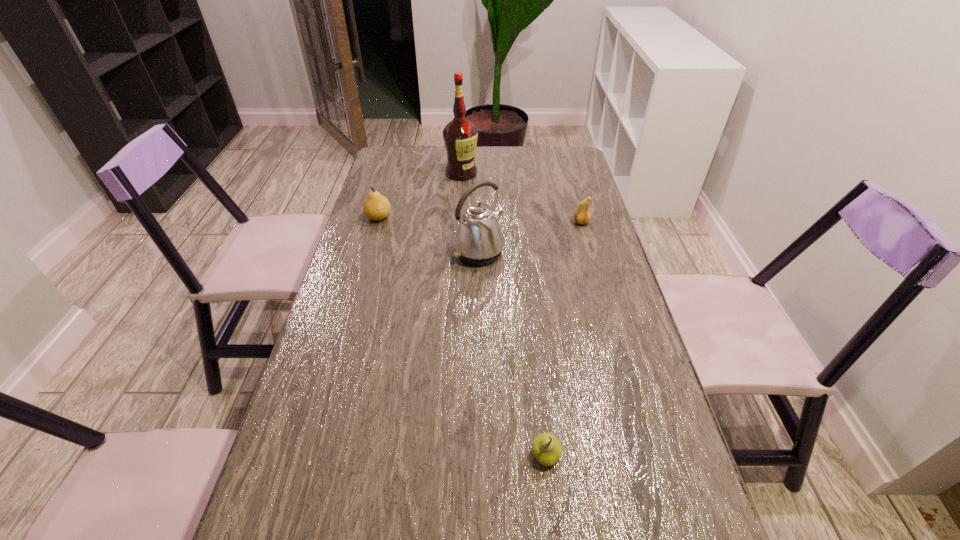
Find the location of `free point between the fourth shortest object and the rightmost pear`. free point between the fourth shortest object and the rightmost pear is located at coordinates (530, 238).

Locate an element on the screen. The width and height of the screenshot is (960, 540). vacant point located between the leftmost object and the second pear from left to right is located at coordinates (462, 336).

Locate an element on the screen. unoccupied area between the alcohol and the rightmost object is located at coordinates (521, 198).

At what (x,y) coordinates should I click in order to perform the action: click on free space between the third shortest object and the nearest pear. Please return your answer as a coordinate pair (x, y). Image resolution: width=960 pixels, height=540 pixels. Looking at the image, I should click on (462, 336).

Find the location of a particular element. The width and height of the screenshot is (960, 540). blank region between the fourth object from left to right and the fourth farthest object is located at coordinates (513, 354).

Where is `vacant space that's between the tallest pear and the fourth farthest object`? The image size is (960, 540). vacant space that's between the tallest pear and the fourth farthest object is located at coordinates (429, 235).

Identify the location of the fourth closest object to the second nearest object. The width and height of the screenshot is (960, 540). (546, 448).

Identify which object is the second closest to the rightmost object. Please provide its 2D coordinates. Your answer should be formatted as a tuple, i.e. [(x, y)], where the tuple contains the x and y coordinates of a point satisfying the conditions above.

[(460, 136)]

At what (x,y) coordinates should I click in order to perform the action: click on pear that is the closest one to the kettle. Please return your answer as a coordinate pair (x, y). This screenshot has width=960, height=540. Looking at the image, I should click on (376, 207).

In order to click on pear that can be found as the closest to the rightmost object in this screenshot , I will do `click(376, 207)`.